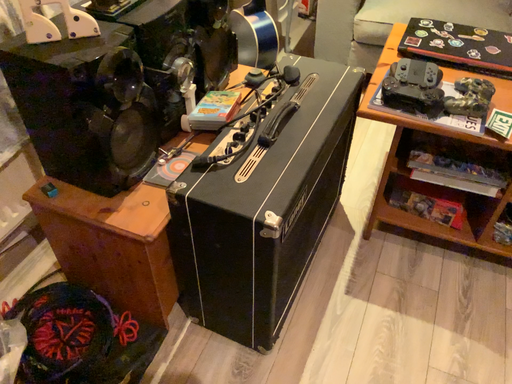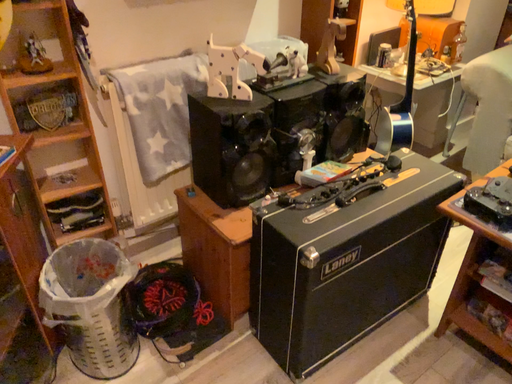
Question: How did the camera likely rotate when shooting the video?

Choices:
 (A) rotated downward
 (B) rotated upward

Answer: (B)